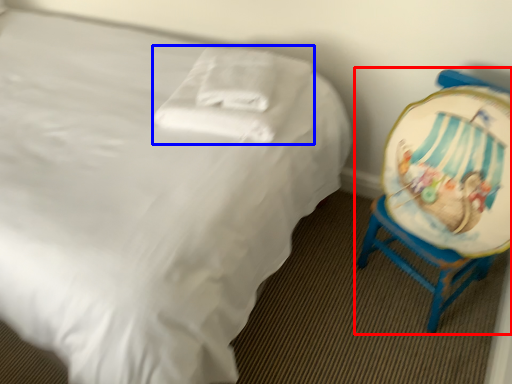
Question: Which of the following is the closest to the observer, chair (highlighted by a red box) or pillow (highlighted by a blue box)?

Choices:
 (A) chair
 (B) pillow

Answer: (A)